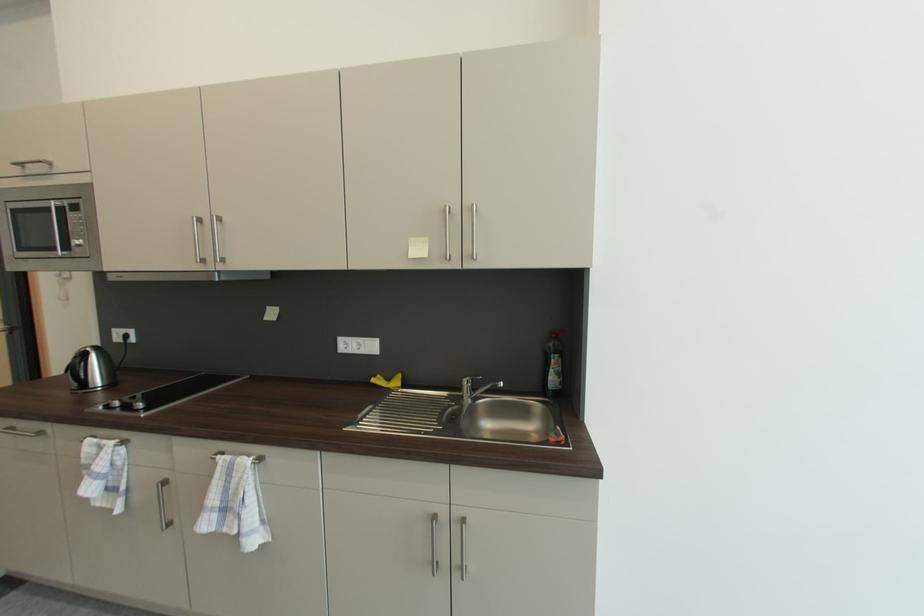
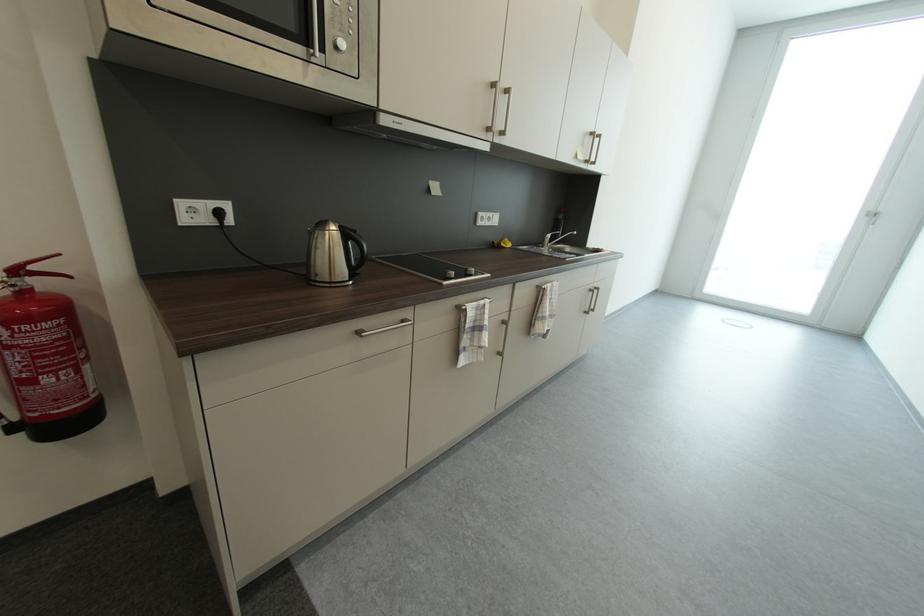
In the second image, find the point that corresponds to the point at 382,378 in the first image.

(501, 244)